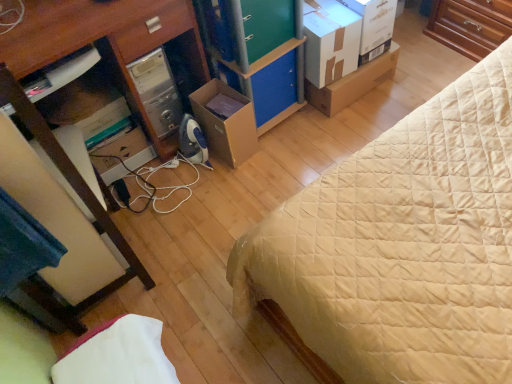
I want to click on empty space that is ontop of white soft mattress at lower left (from a real-world perspective), so click(111, 357).